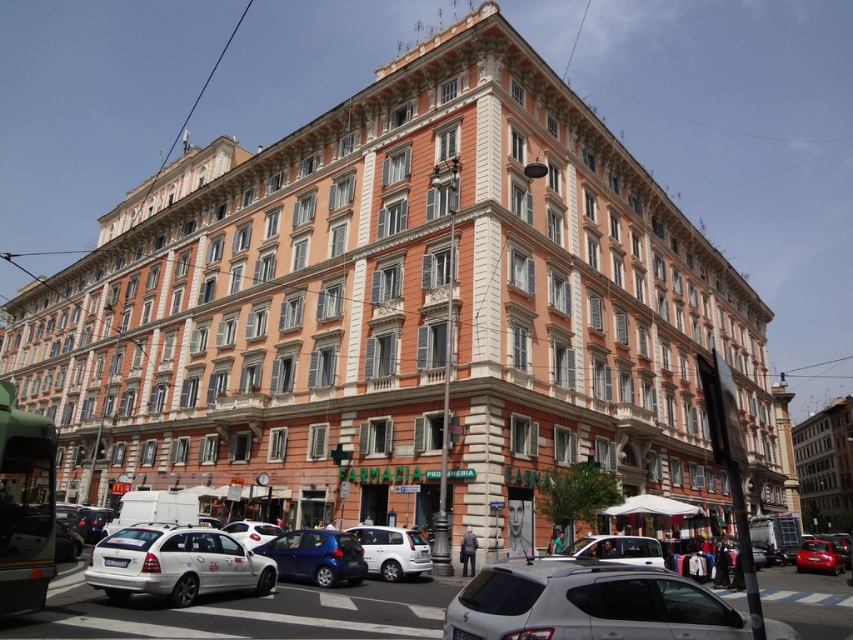
Question: Can you confirm if white matte car at lower left is wider than metallic blue car at center?

Choices:
 (A) no
 (B) yes

Answer: (B)

Question: Is the position of white matte car at lower left less distant than that of shiny red car at lower right?

Choices:
 (A) no
 (B) yes

Answer: (B)

Question: Which is farther from the white matte car at lower left?

Choices:
 (A) silver metallic car at lower center
 (B) white matte car at lower center

Answer: (A)

Question: Which of the following is the closest to the observer?

Choices:
 (A) orange stone building at center
 (B) white matte car at lower left
 (C) white matte van at lower center
 (D) white matte car at lower center

Answer: (D)

Question: Does silver metallic car at lower center have a lesser width compared to white glossy car at center?

Choices:
 (A) no
 (B) yes

Answer: (A)

Question: Which of these objects is positioned closest to the white matte car at lower left?

Choices:
 (A) shiny red car at lower right
 (B) white glossy car at center
 (C) white matte car at lower center
 (D) metallic blue car at center

Answer: (D)